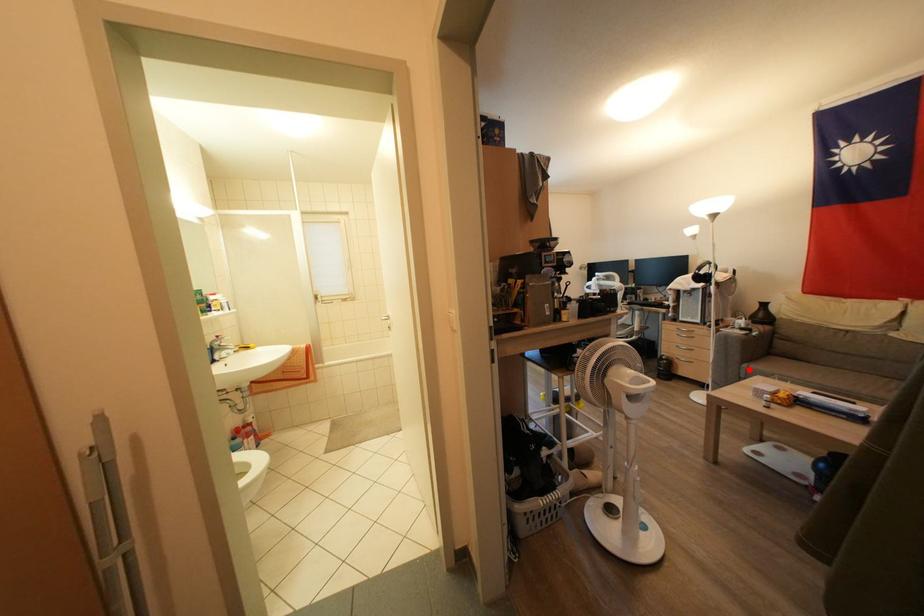
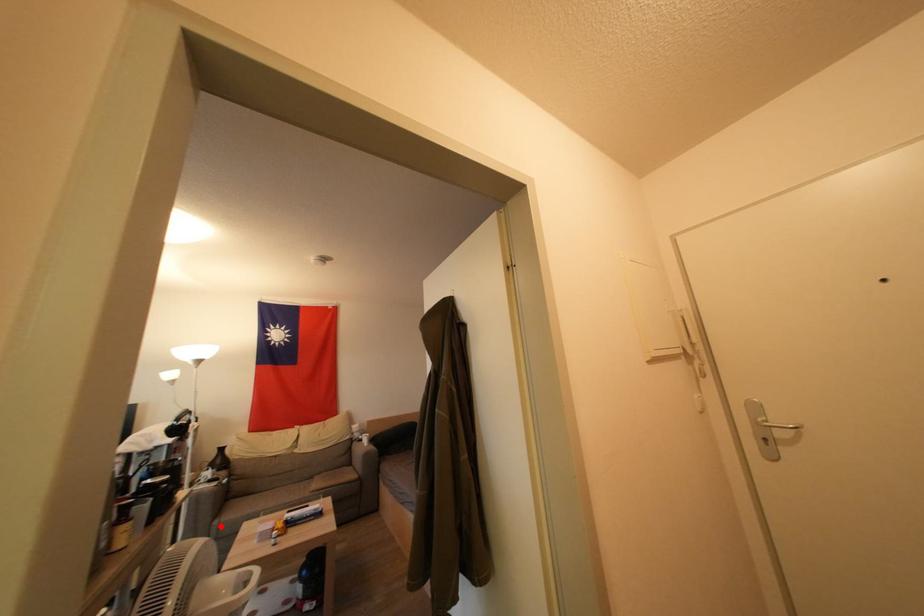
I am providing you with two images of the same scene from different viewpoints. A red point is marked on the first image and another point is marked on the second image. Does the point marked in image1 correspond to the same location as the one in image2?

Yes